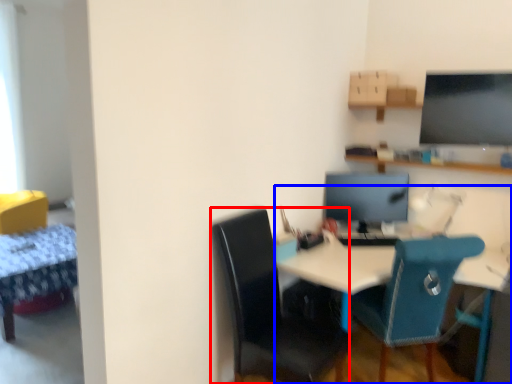
Question: Which object is closer to the camera taking this photo, chair (highlighted by a red box) or desk (highlighted by a blue box)?

Choices:
 (A) chair
 (B) desk

Answer: (A)